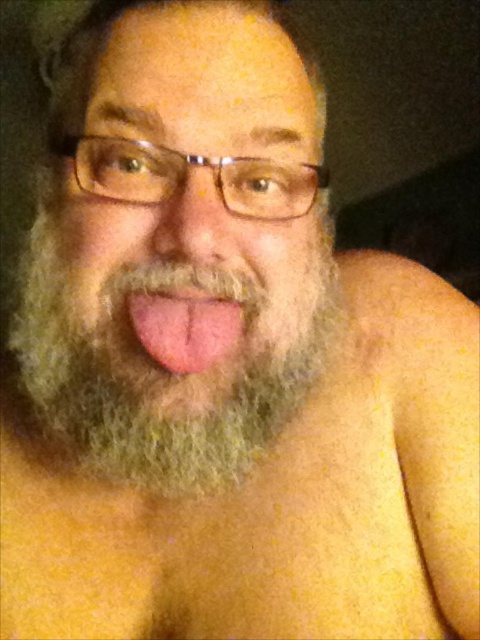
Is gray beard at center smaller than gray fuzzy beard at center?

Correct, gray beard at center occupies less space than gray fuzzy beard at center.

Is gray beard at center bigger than gray fuzzy beard at center?

No.

Is point (148, 403) farther from viewer compared to point (142, 456)?

That is False.

This screenshot has width=480, height=640. Find the location of `gray beard at center`. gray beard at center is located at coordinates point(192,195).

Can you confirm if gray fuzzy beard at center is positioned to the right of pink flesh at center?

Incorrect, gray fuzzy beard at center is not on the right side of pink flesh at center.

Between point (45, 294) and point (200, 321), which one is positioned behind?

Positioned behind is point (45, 294).

Find the location of `gray fuzzy beard at center`. gray fuzzy beard at center is located at coordinates (168, 358).

Does gray beard at center have a smaller size compared to pink flesh at center?

Actually, gray beard at center might be larger than pink flesh at center.

Can you confirm if gray beard at center is wider than pink flesh at center?

Yes, gray beard at center is wider than pink flesh at center.

Is point (143, 109) more distant than point (167, 339)?

No, it is not.

Find the location of `gray beard at center`. gray beard at center is located at coordinates (192, 195).